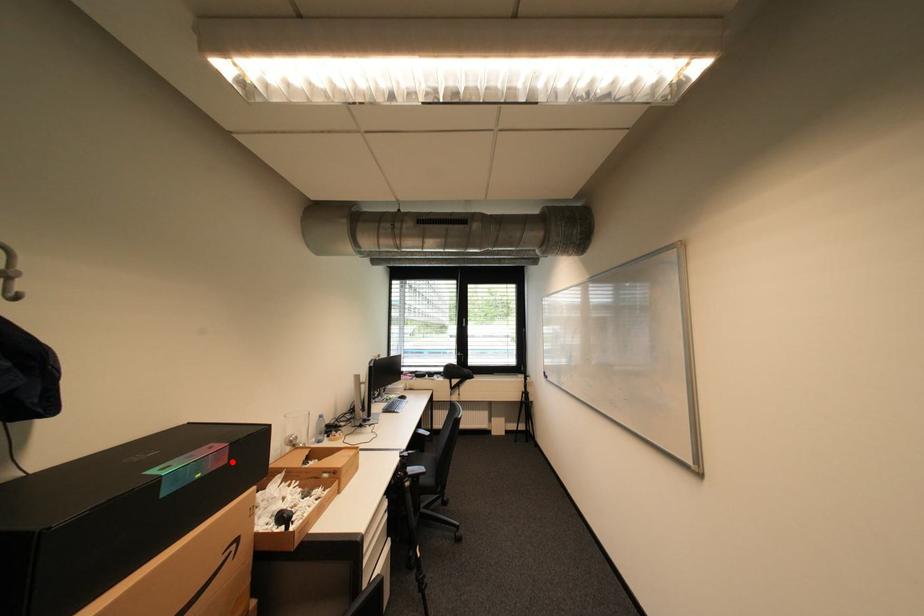
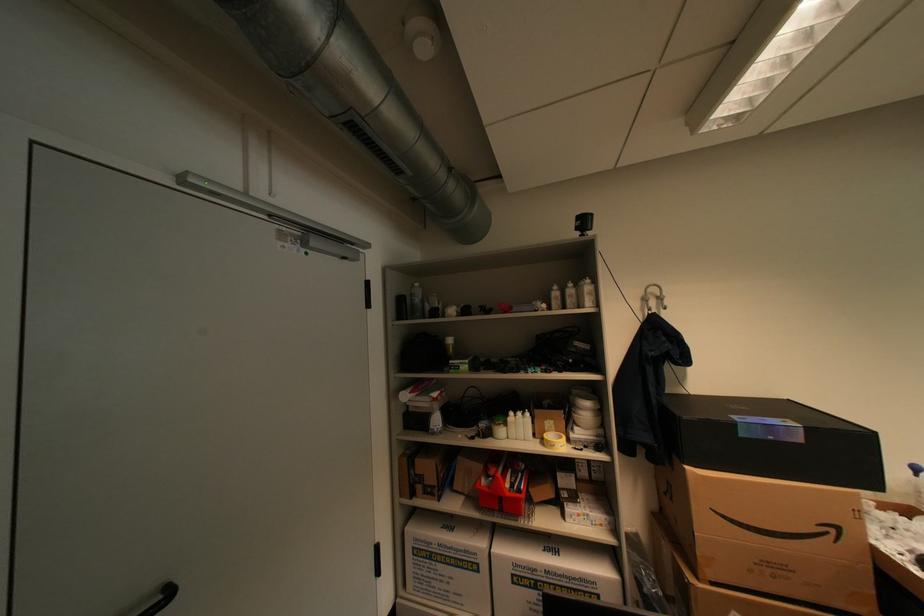
Question: I am providing you with two images of the same scene from different viewpoints. Given a red point in image1, look at the same physical point in image2. Is it:

Choices:
 (A) Closer to the viewpoint
 (B) Farther from the viewpoint

Answer: (A)